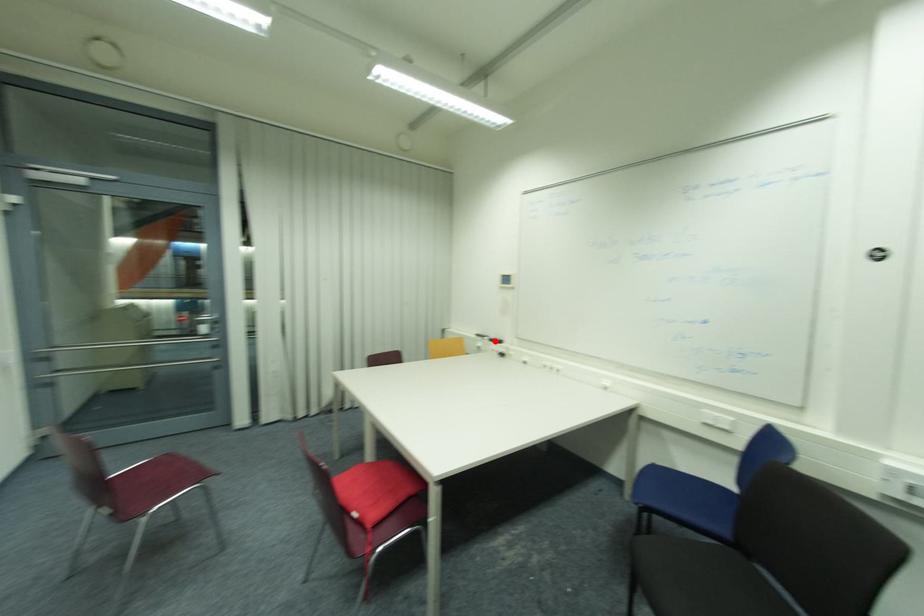
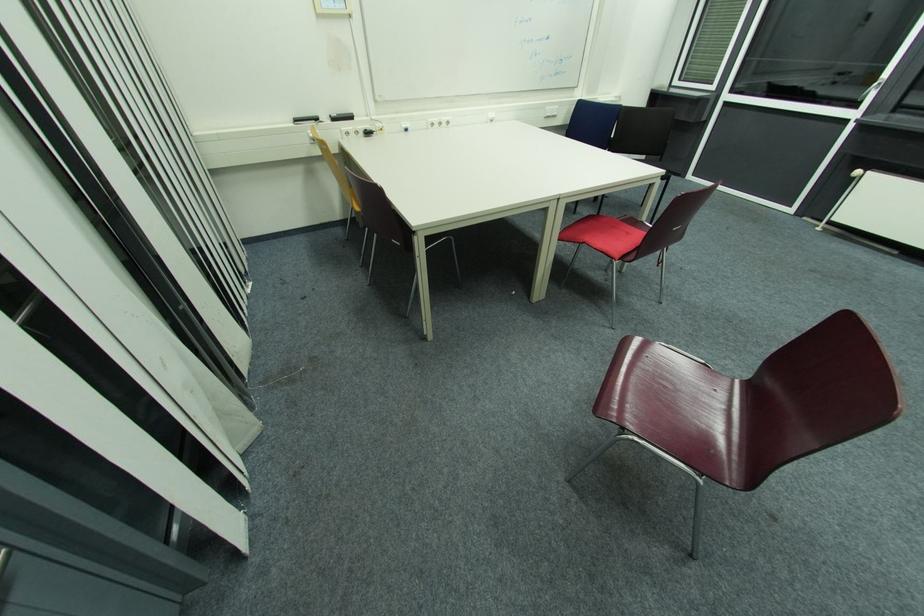
Question: I am providing you with two images of the same scene from different viewpoints. Given a red point in image1, look at the same physical point in image2. Is it:

Choices:
 (A) Closer to the viewpoint
 (B) Farther from the viewpoint

Answer: (A)